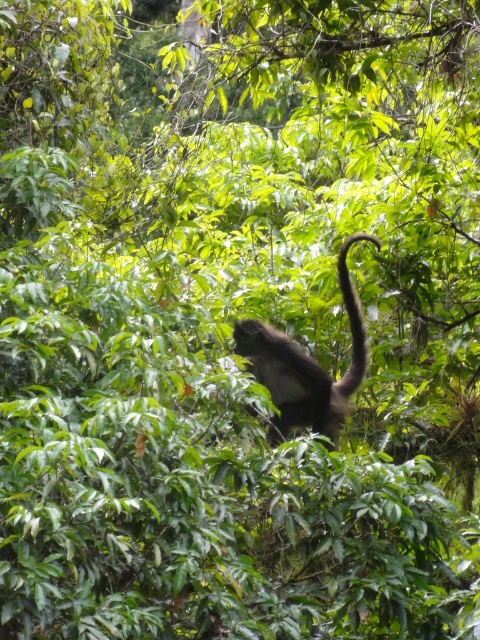
Question: Which point is farther to the camera?

Choices:
 (A) brown fuzzy tail at upper center
 (B) brown furry monkey at center

Answer: (A)

Question: Considering the relative positions of brown furry monkey at center and brown fuzzy tail at upper center in the image provided, where is brown furry monkey at center located with respect to brown fuzzy tail at upper center?

Choices:
 (A) left
 (B) right

Answer: (A)

Question: Is brown furry monkey at center to the left of brown fuzzy tail at upper center from the viewer's perspective?

Choices:
 (A) yes
 (B) no

Answer: (A)

Question: Which object is closer to the camera taking this photo?

Choices:
 (A) brown fuzzy tail at upper center
 (B) brown furry monkey at center

Answer: (B)

Question: Does brown furry monkey at center appear under brown fuzzy tail at upper center?

Choices:
 (A) no
 (B) yes

Answer: (B)